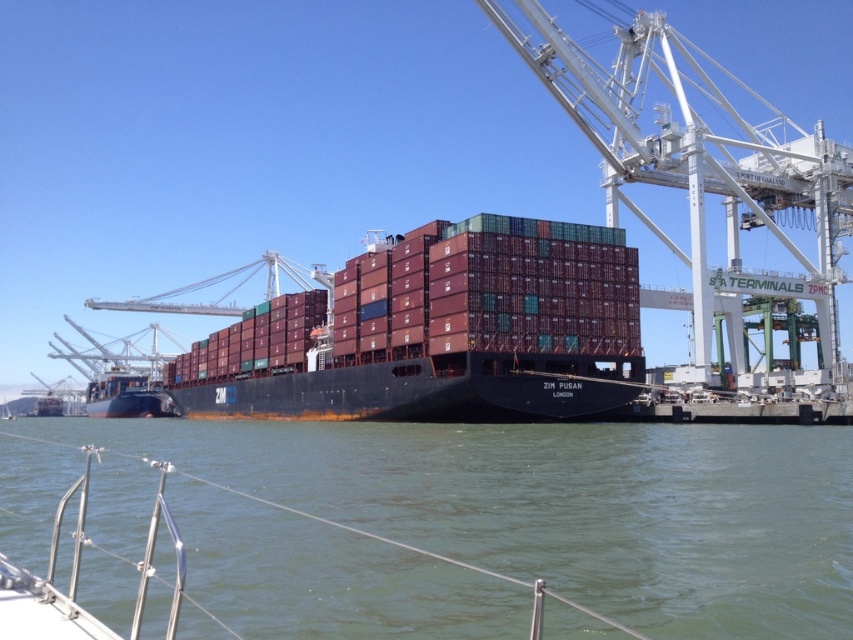
You are a photographer on a boat taking pictures of the ship. You notice the greenish water at lower center and the white metal crane at upper right. Which object is closer to the left side of your view?

The greenish water at lower center is closer to the left side of the view because it is positioned to the left of the white metal crane at upper right.

You are a photographer standing on the deck of a boat. You want to capture a photo of the maroon matte container ship at center and the greenish water at lower center. Which object should you focus on first if you want to include both in your frame without zooming in or out?

The greenish water at lower center has a smaller size compared to the maroon matte container ship at center, so you should focus on the maroon matte container ship at center first to ensure it fits properly in the frame, then adjust to include the smaller greenish water at lower center without zooming.

You are standing on the deck of the boat in the foreground and want to observe the greenish water at lower center. Based on your position, where should you look to see it?

The greenish water at lower center is located at point (508, 506), so you should look towards the lower center area of the scene to see it.